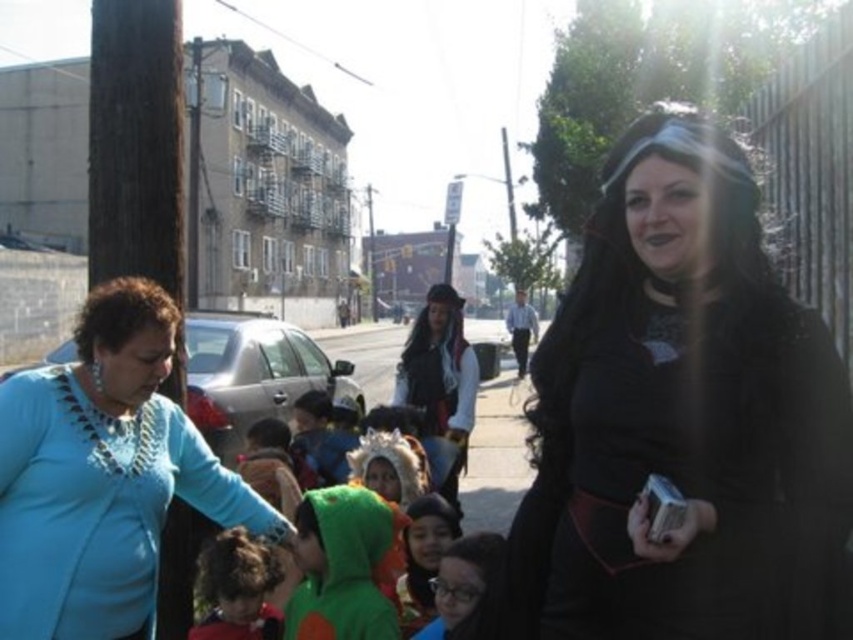
Question: Can you confirm if black matte dress at center is positioned to the right of curly brown hair at lower left?

Choices:
 (A) yes
 (B) no

Answer: (A)

Question: Which of the following is the closest to the observer?

Choices:
 (A) click(x=625, y=188)
 (B) click(x=256, y=616)
 (C) click(x=398, y=632)
 (D) click(x=3, y=534)

Answer: (D)

Question: Which point is closer to the camera taking this photo?

Choices:
 (A) (409, 353)
 (B) (254, 580)

Answer: (B)

Question: Does velvet green costume at center have a lesser width compared to curly brown hair at lower left?

Choices:
 (A) yes
 (B) no

Answer: (B)

Question: Which of the following is the farthest from the observer?

Choices:
 (A) (138, 397)
 (B) (326, 563)
 (C) (767, 460)
 (D) (410, 342)

Answer: (D)

Question: Is blue matte shirt at lower left smaller than velvet green costume at center?

Choices:
 (A) yes
 (B) no

Answer: (A)